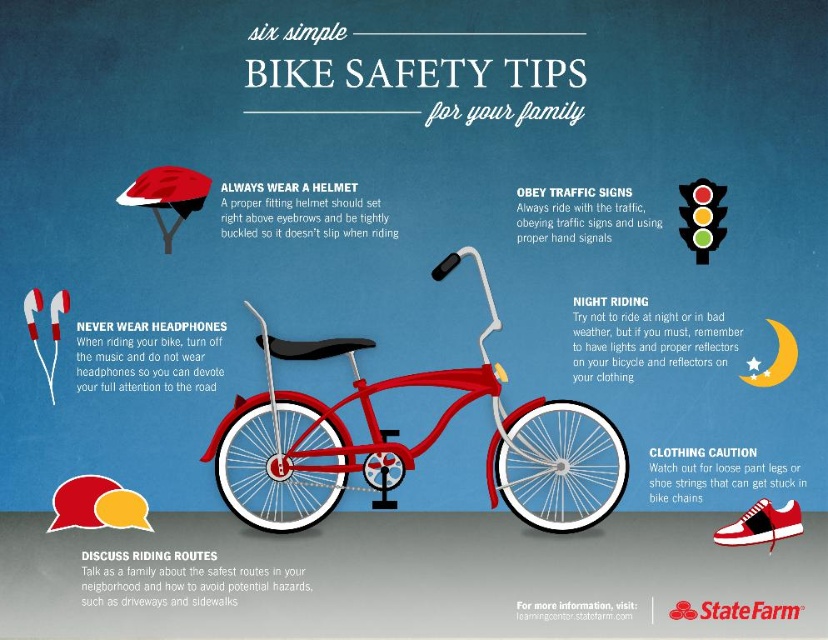
Can you confirm if shiny metallic bicycle at center is wider than black plastic traffic light at upper right?

Correct, the width of shiny metallic bicycle at center exceeds that of black plastic traffic light at upper right.

Measure the distance between point (x=337, y=433) and camera.

The distance of point (x=337, y=433) from camera is 13.84 feet.

In the scene shown: Who is more distant from viewer, (278, 394) or (724, 230)?

The point (724, 230) is behind.

Image resolution: width=828 pixels, height=640 pixels. I want to click on shiny metallic bicycle at center, so click(414, 444).

Who is higher up, black plastic traffic light at upper right or red leather shoe at lower right?

black plastic traffic light at upper right is above.

Between point (699, 218) and point (725, 531), which one is positioned in front?

Positioned in front is point (725, 531).

Is point (701, 244) farther from camera compared to point (802, 525)?

That is True.

The width and height of the screenshot is (828, 640). What are the coordinates of `black plastic traffic light at upper right` in the screenshot? It's located at pyautogui.click(x=701, y=218).

At what (x,y) coordinates should I click in order to perform the action: click on shiny metallic bicycle at center. Please return your answer as a coordinate pair (x, y). The image size is (828, 640). Looking at the image, I should click on (414, 444).

Is shiny metallic bicycle at center closer to camera compared to red leather shoe at lower right?

Yes, it is in front of red leather shoe at lower right.

Which is behind, point (532, 452) or point (774, 513)?

The point (532, 452) is behind.

Locate an element on the screen. The height and width of the screenshot is (640, 828). shiny metallic bicycle at center is located at coordinates (414, 444).